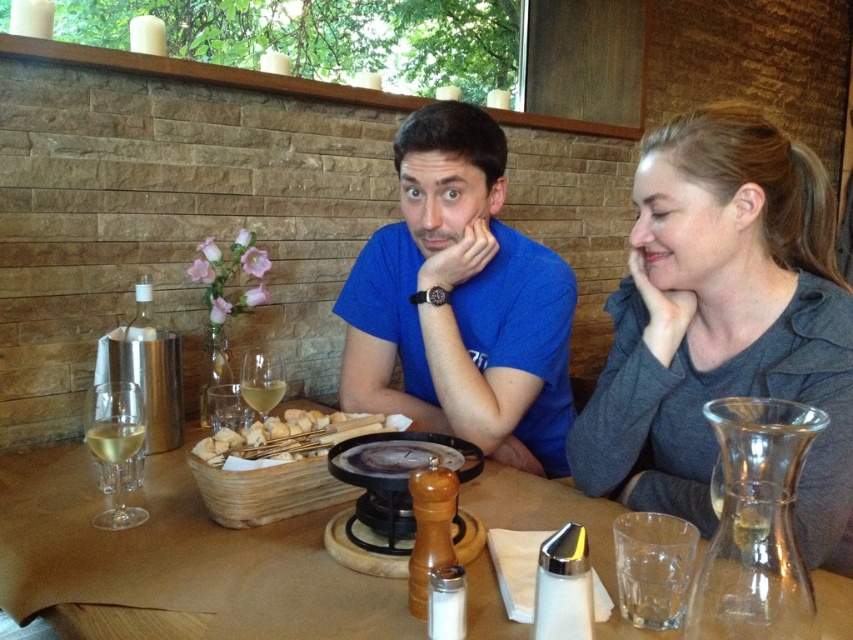
Is clear glass wine glass at lower left positioned in front of translucent glass wine at center?

That is True.

Is clear glass wine glass at lower left taller than translucent glass wine at center?

Correct, clear glass wine glass at lower left is much taller as translucent glass wine at center.

Which is in front, point (125, 413) or point (247, 401)?

Point (125, 413) is in front.

Locate an element on the screen. clear glass wine glass at lower left is located at coordinates (115, 445).

Locate an element on the screen. translucent glass wine at table left is located at coordinates (114, 440).

Who is positioned more to the left, translucent glass wine at table left or translucent glass wine at center?

translucent glass wine at table left is more to the left.

Which is in front, point (119, 465) or point (250, 396)?

Point (119, 465)

What are the coordinates of `translucent glass wine at table left` in the screenshot? It's located at (114, 440).

Is breadsticks at center thinner than translucent glass wine at table left?

No, breadsticks at center is not thinner than translucent glass wine at table left.

Image resolution: width=853 pixels, height=640 pixels. Describe the element at coordinates (283, 436) in the screenshot. I see `breadsticks at center` at that location.

Does point (331, 422) come farther from viewer compared to point (136, 422)?

Yes.

Locate an element on the screen. The width and height of the screenshot is (853, 640). breadsticks at center is located at coordinates (283, 436).